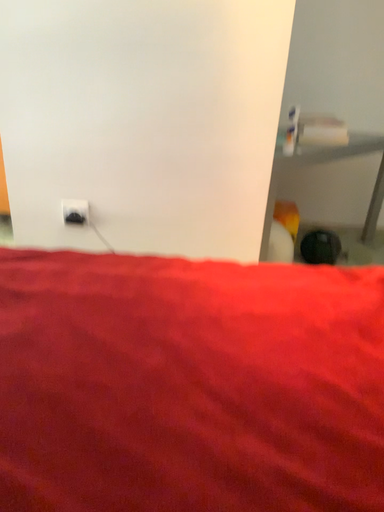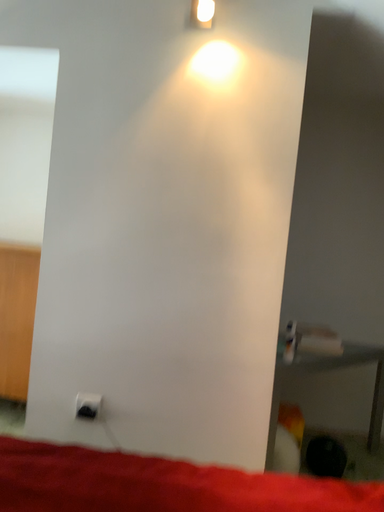
Question: Which way did the camera rotate in the video?

Choices:
 (A) rotated upward
 (B) rotated downward

Answer: (A)